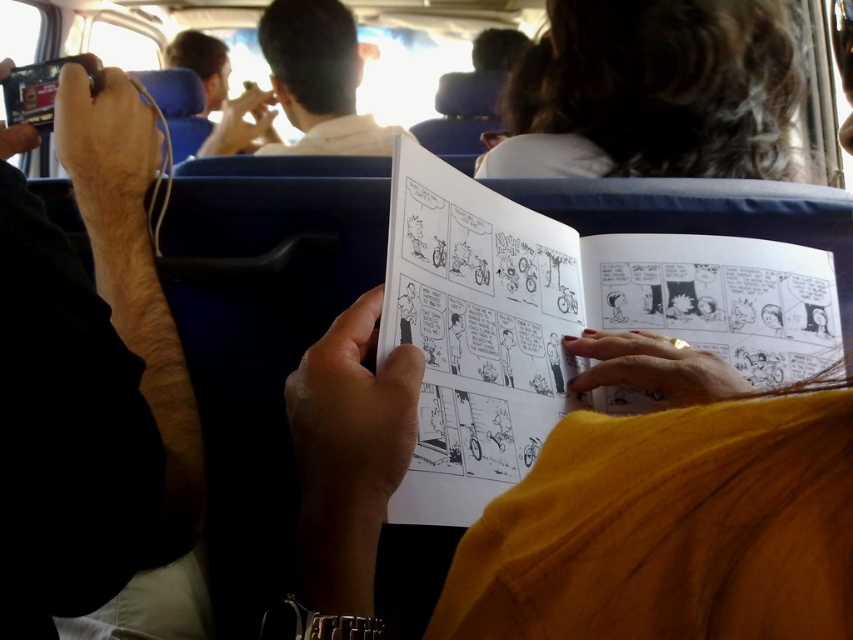
Looking at this image, is black plastic phone at left bigger than dark curly hair at upper center?

Incorrect, black plastic phone at left is not larger than dark curly hair at upper center.

Between black plastic phone at left and dark curly hair at upper center, which one is positioned higher?

dark curly hair at upper center

Identify the location of black plastic phone at left. The width and height of the screenshot is (853, 640). (96, 358).

Is black paper comic book at center positioned at the back of dark curly hair at upper center?

No, it is in front of dark curly hair at upper center.

Is black paper comic book at center to the right of dark curly hair at upper center from the viewer's perspective?

No, black paper comic book at center is not to the right of dark curly hair at upper center.

What do you see at coordinates (564, 321) in the screenshot?
I see `black paper comic book at center` at bounding box center [564, 321].

At what (x,y) coordinates should I click in order to perform the action: click on black paper comic book at center. Please return your answer as a coordinate pair (x, y). The height and width of the screenshot is (640, 853). Looking at the image, I should click on (564, 321).

Who is more distant from viewer, (450,449) or (27,344)?

The point (450,449) is more distant.

Between point (508, 234) and point (59, 452), which one is positioned in front?

Point (59, 452) is more forward.

Between point (386, 333) and point (0, 384), which one is positioned in front?

Point (0, 384) is more forward.

Find the location of a particular element. black paper comic book at center is located at coordinates (564, 321).